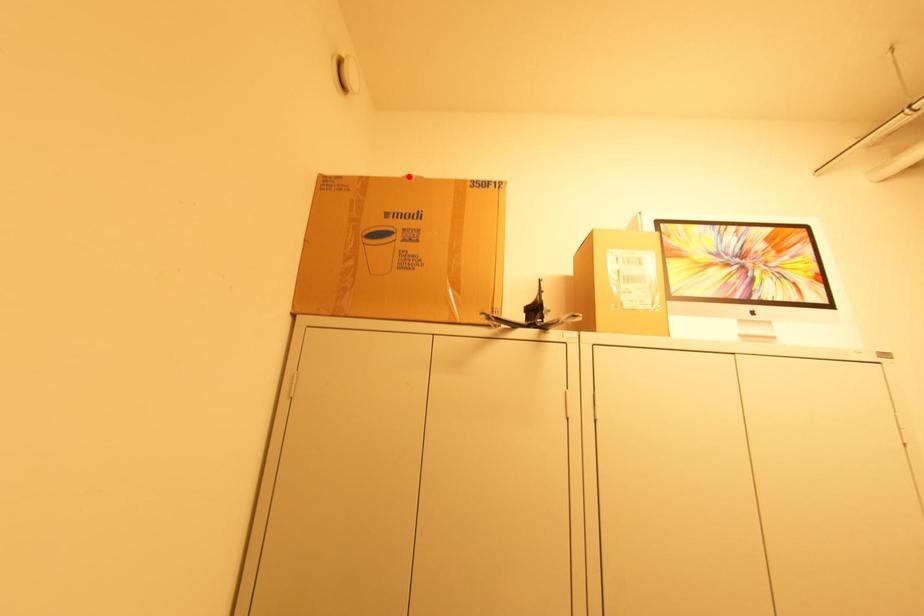
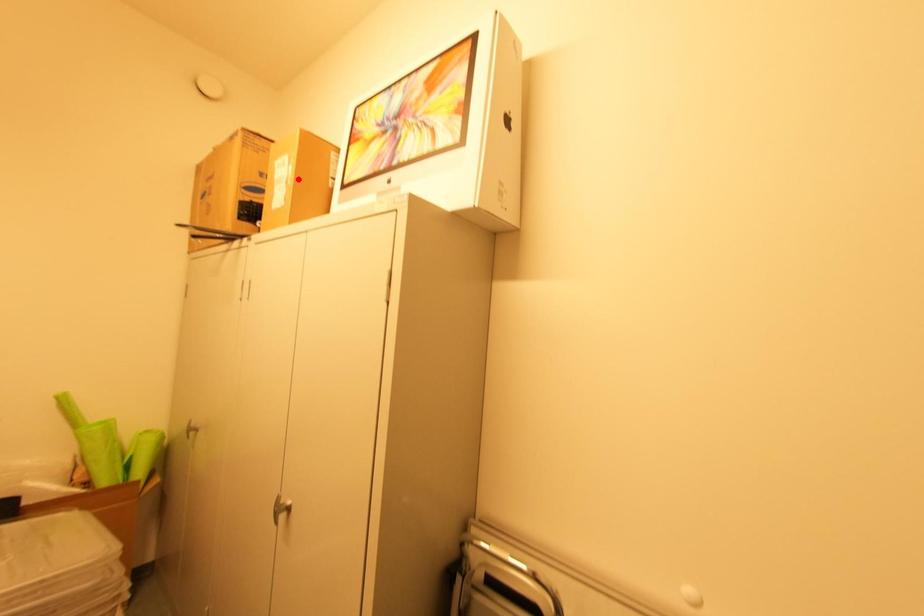
I am providing you with two images of the same scene from different viewpoints. A red point is marked on the first image and another point is marked on the second image. Does the point marked in image1 correspond to the same location as the one in image2?

No